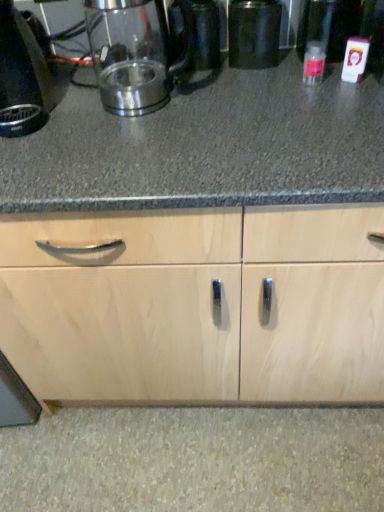
Question: Is point (264, 28) positioned closer to the camera than point (109, 55)?

Choices:
 (A) farther
 (B) closer

Answer: (B)

Question: From a real-world perspective, relative to satin metallic kettle at upper left, is metallic black canister at center vertically above or below?

Choices:
 (A) above
 (B) below

Answer: (B)

Question: Which object is the farthest from the metallic black canister at center?

Choices:
 (A) black plastic kettle at left
 (B) clear plastic bottle at right
 (C) satin metallic kettle at upper left

Answer: (A)

Question: Based on their relative distances, which object is farther from the satin metallic kettle at upper left?

Choices:
 (A) metallic black canister at center
 (B) black plastic kettle at left
 (C) clear plastic bottle at right

Answer: (C)